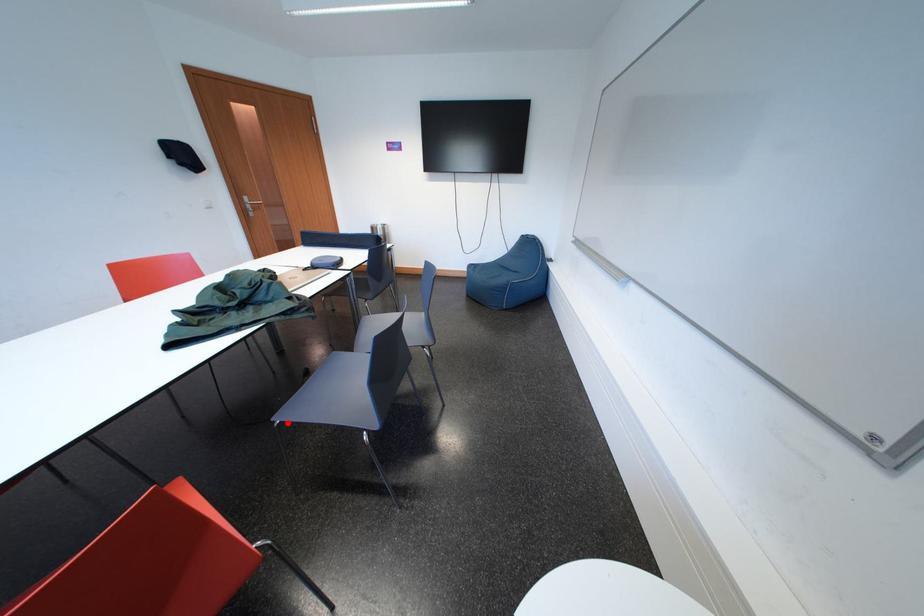
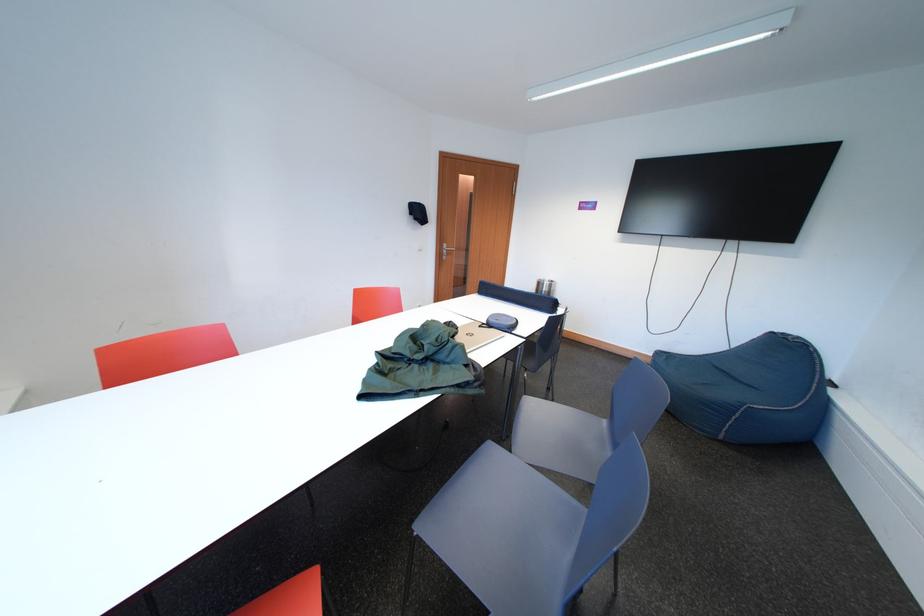
The point at the highlighted location is marked in the first image. Where is the corresponding point in the second image?

(429, 532)